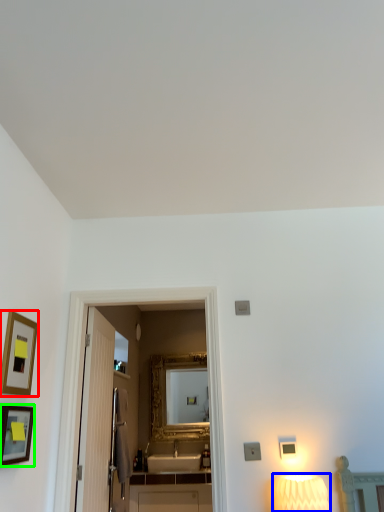
Question: Estimate the real-world distances between objects in this image. Which object is closer to picture frame (highlighted by a red box), lamp (highlighted by a blue box) or picture frame (highlighted by a green box)?

Choices:
 (A) lamp
 (B) picture frame

Answer: (B)